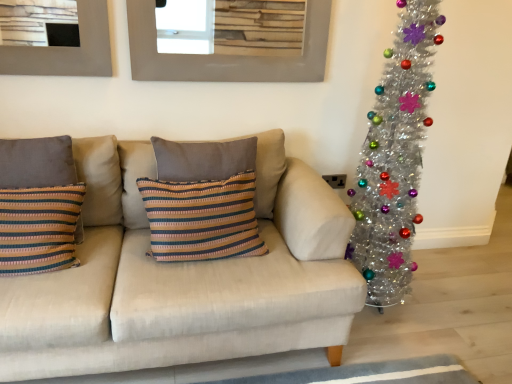
Question: Is striped fabric cushion at center, placed as the 1th pillow when sorted from right to left, a part of shiny silver christmas tree at right?

Choices:
 (A) yes
 (B) no

Answer: (B)

Question: Is shiny silver christmas tree at right behind striped fabric cushion at center, placed as the 1th pillow when sorted from right to left?

Choices:
 (A) yes
 (B) no

Answer: (B)

Question: Does shiny silver christmas tree at right have a greater width compared to striped fabric cushion at center, placed as the 1th pillow when sorted from right to left?

Choices:
 (A) no
 (B) yes

Answer: (B)

Question: Considering the relative sizes of shiny silver christmas tree at right and striped fabric cushion at center, placed as the 1th pillow when sorted from right to left, in the image provided, is shiny silver christmas tree at right taller than striped fabric cushion at center, placed as the 1th pillow when sorted from right to left,?

Choices:
 (A) yes
 (B) no

Answer: (A)

Question: Does shiny silver christmas tree at right have a larger size compared to striped fabric cushion at center, placed as the 1th pillow when sorted from right to left?

Choices:
 (A) yes
 (B) no

Answer: (A)

Question: Is shiny silver christmas tree at right thinner than striped fabric cushion at center, placed as the 1th pillow when sorted from right to left?

Choices:
 (A) no
 (B) yes

Answer: (A)

Question: Is matte gray picture frame at upper center facing away from striped fabric cushion at center, placed as the 2th pillow when sorted from left to right?

Choices:
 (A) yes
 (B) no

Answer: (B)

Question: Does matte gray picture frame at upper center appear on the right side of striped fabric cushion at center, placed as the 1th pillow when sorted from right to left?

Choices:
 (A) yes
 (B) no

Answer: (A)

Question: Is matte gray picture frame at upper center not within striped fabric cushion at center, placed as the 2th pillow when sorted from left to right?

Choices:
 (A) yes
 (B) no

Answer: (A)

Question: Does matte gray picture frame at upper center have a greater width compared to striped fabric cushion at center, placed as the 2th pillow when sorted from left to right?

Choices:
 (A) no
 (B) yes

Answer: (A)

Question: From a real-world perspective, is matte gray picture frame at upper center on striped fabric cushion at center, placed as the 2th pillow when sorted from left to right?

Choices:
 (A) yes
 (B) no

Answer: (A)

Question: Does matte gray picture frame at upper center appear on the left side of striped fabric cushion at center, placed as the 1th pillow when sorted from right to left?

Choices:
 (A) yes
 (B) no

Answer: (B)

Question: Can you confirm if shiny silver christmas tree at right is wider than beige fabric couch at center?

Choices:
 (A) no
 (B) yes

Answer: (A)